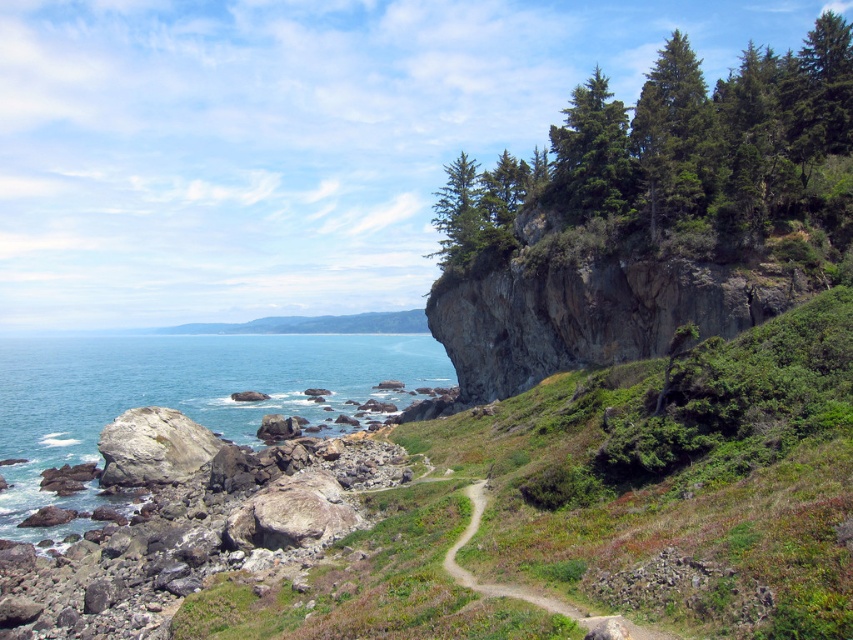
You are a hiker who wants to take a photo of the smooth gray rock at lower left without the green textured pine at upper right blocking the view. Which direction should you move to achieve this?

The green textured pine at upper right is positioned over smooth gray rock at lower left. To avoid the pine blocking the view, move to the left side of the rock so the pine is out of frame.

You are a hiker standing at the starting point of the dirt path. You want to reach the green textured pine at upper right. Which direction should you head towards?

The green textured pine at upper right is located at point (x=672, y=154), so you should head towards the upper right direction to reach it.